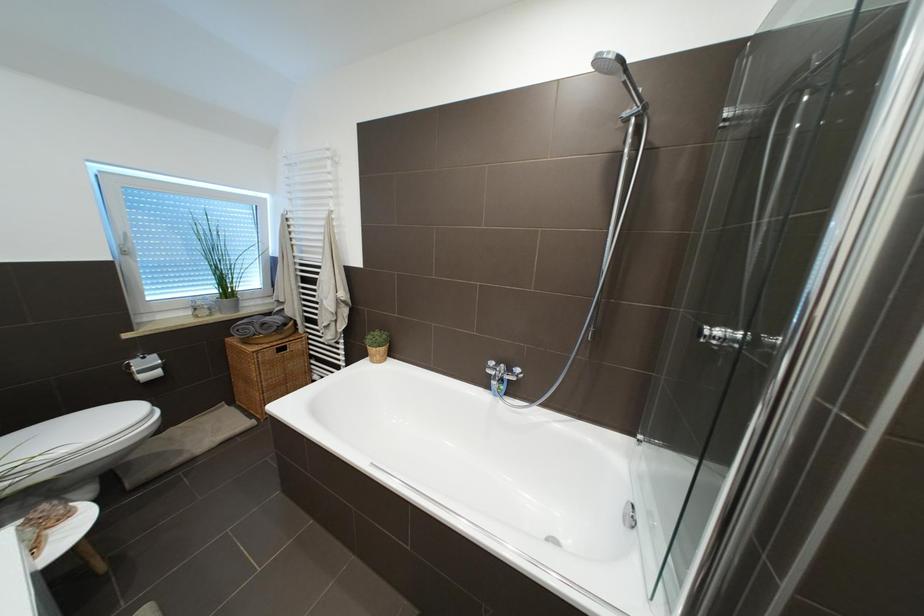
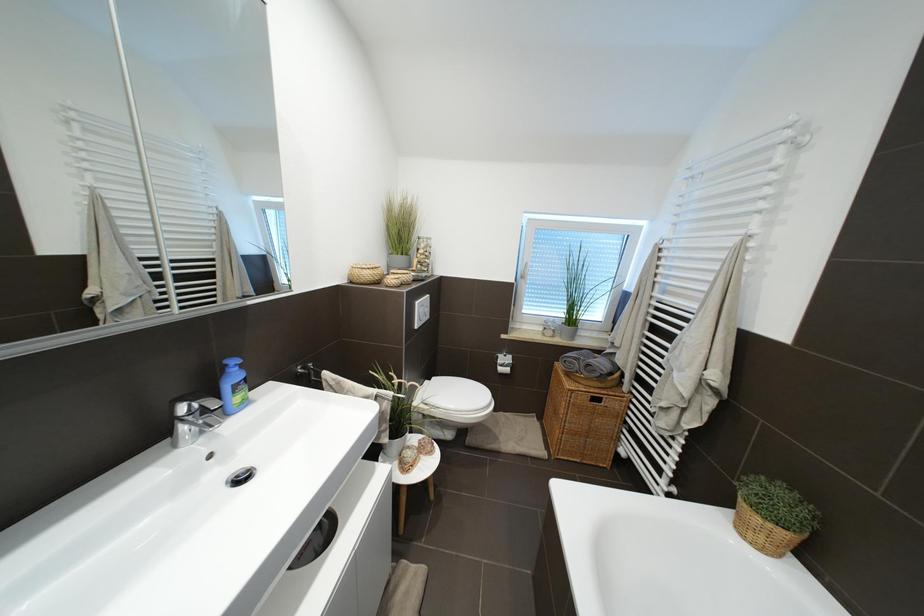
Question: The first image is from the beginning of the video and the second image is from the end. How did the camera likely rotate when shooting the video?

Choices:
 (A) Left
 (B) Right
 (C) Up
 (D) Down

Answer: (A)